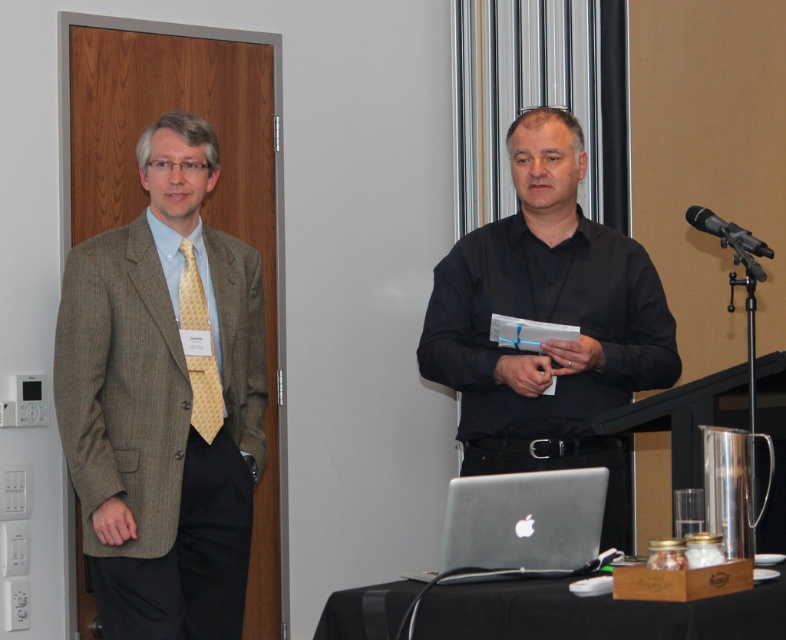
Based on the photo, does black matte shirt at center lie behind black metallic microphone at upper right?

Yes, black matte shirt at center is behind black metallic microphone at upper right.

Is black matte shirt at center wider than black metallic microphone at upper right?

Correct, the width of black matte shirt at center exceeds that of black metallic microphone at upper right.

Does point (605, 456) come farther from viewer compared to point (722, 220)?

That is False.

Find the location of a particular element. The width and height of the screenshot is (786, 640). black matte shirt at center is located at coordinates (549, 321).

Between point (476, 508) and point (718, 228), which one is positioned in front?

Positioned in front is point (476, 508).

The width and height of the screenshot is (786, 640). I want to click on sleek silver laptop at center, so click(522, 524).

Is yellowgeometric patterned fabrictie at left wider than black metallic microphone at upper right?

Incorrect, yellowgeometric patterned fabrictie at left's width does not surpass black metallic microphone at upper right's.

Does yellowgeometric patterned fabrictie at left have a lesser width compared to black metallic microphone at upper right?

Yes, yellowgeometric patterned fabrictie at left is thinner than black metallic microphone at upper right.

What do you see at coordinates (197, 348) in the screenshot? Image resolution: width=786 pixels, height=640 pixels. I see `yellowgeometric patterned fabrictie at left` at bounding box center [197, 348].

This screenshot has height=640, width=786. I want to click on yellowgeometric patterned fabrictie at left, so click(197, 348).